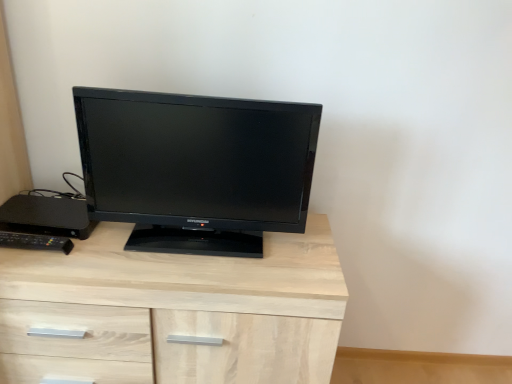
I want to click on free point in front of black glossy monitor at center, so click(188, 271).